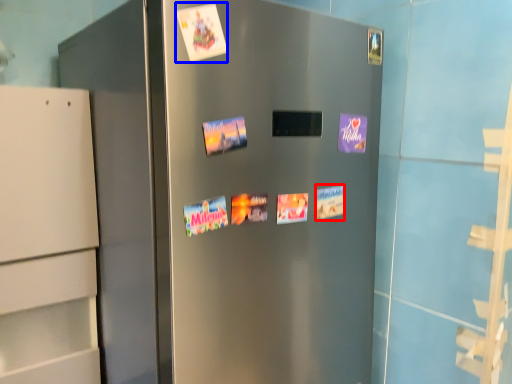
Question: Which point is closer to the camera, postcard (highlighted by a red box) or flyer (highlighted by a blue box)?

Choices:
 (A) postcard
 (B) flyer

Answer: (B)